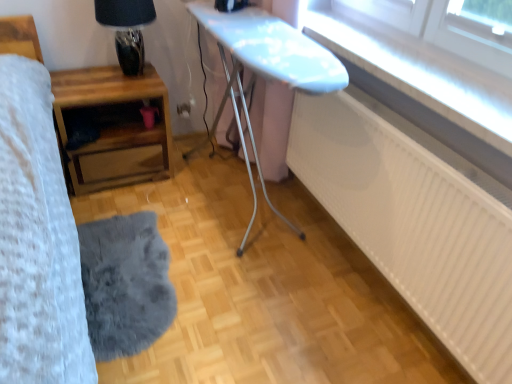
This screenshot has height=384, width=512. What are the coordinates of `vacant space in front of matte glass table lamp at upper left` in the screenshot? It's located at (106, 91).